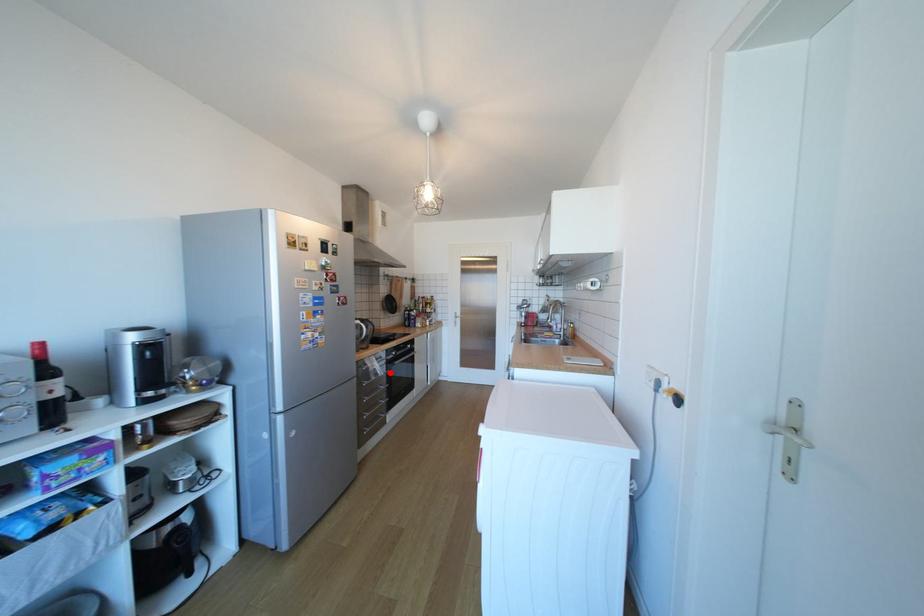
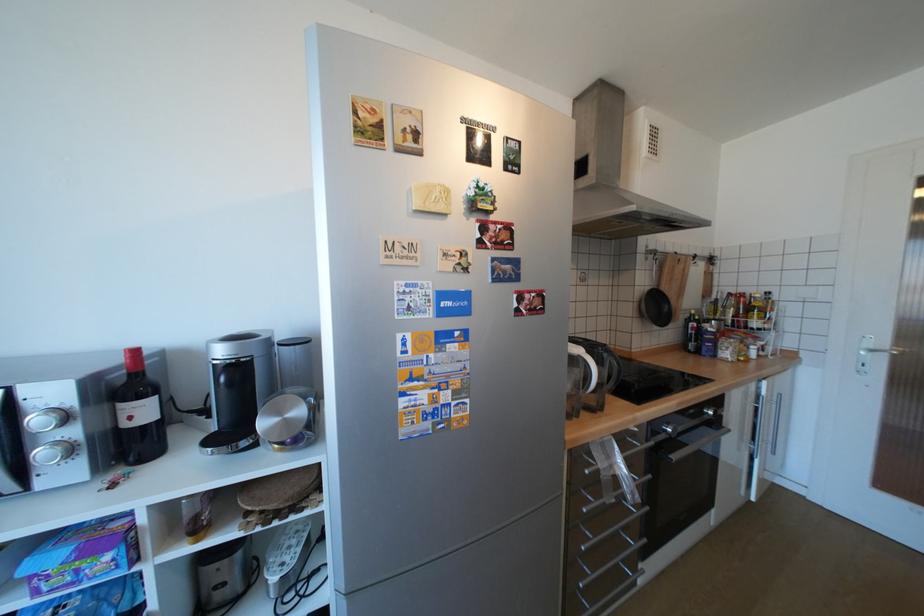
Where in the second image is the point corresponding to the highlighted location from the first image?

(641, 493)